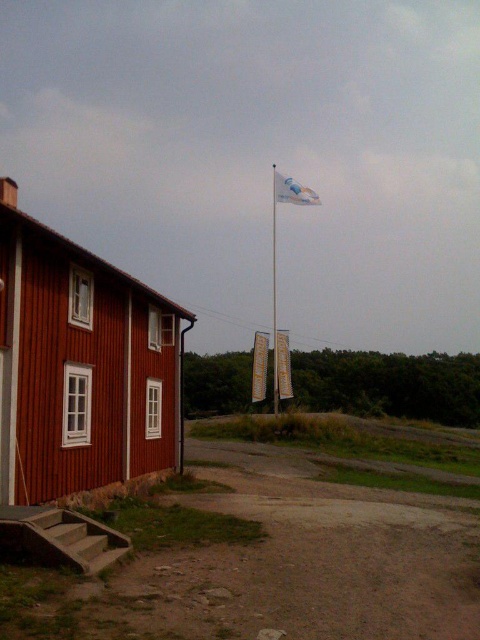
Can you confirm if wooden house at left is positioned to the left of yellow fabric banner at center?

Correct, you'll find wooden house at left to the left of yellow fabric banner at center.

Which is more to the right, wooden house at left or yellow fabric banner at center?

Positioned to the right is yellow fabric banner at center.

Is point (46, 332) positioned behind point (252, 400)?

No.

The width and height of the screenshot is (480, 640). I want to click on wooden house at left, so click(x=80, y=365).

Can you confirm if wooden house at left is wider than white glossy flag pole at center?

In fact, wooden house at left might be narrower than white glossy flag pole at center.

Between wooden house at left and white glossy flag pole at center, which one appears on the left side from the viewer's perspective?

From the viewer's perspective, wooden house at left appears more on the left side.

Which is in front, point (134, 330) or point (274, 189)?

Point (134, 330) is in front.

At what (x,y) coordinates should I click in order to perform the action: click on wooden house at left. Please return your answer as a coordinate pair (x, y). The width and height of the screenshot is (480, 640). Looking at the image, I should click on (80, 365).

Who is positioned more to the right, white glossy flag pole at center or yellow fabric sign at center?

From the viewer's perspective, white glossy flag pole at center appears more on the right side.

Can you confirm if white glossy flag pole at center is positioned to the right of yellow fabric sign at center?

Indeed, white glossy flag pole at center is positioned on the right side of yellow fabric sign at center.

Describe the element at coordinates (275, 288) in the screenshot. The width and height of the screenshot is (480, 640). I see `white glossy flag pole at center` at that location.

Identify the location of white glossy flag pole at center. This screenshot has height=640, width=480. (275, 288).